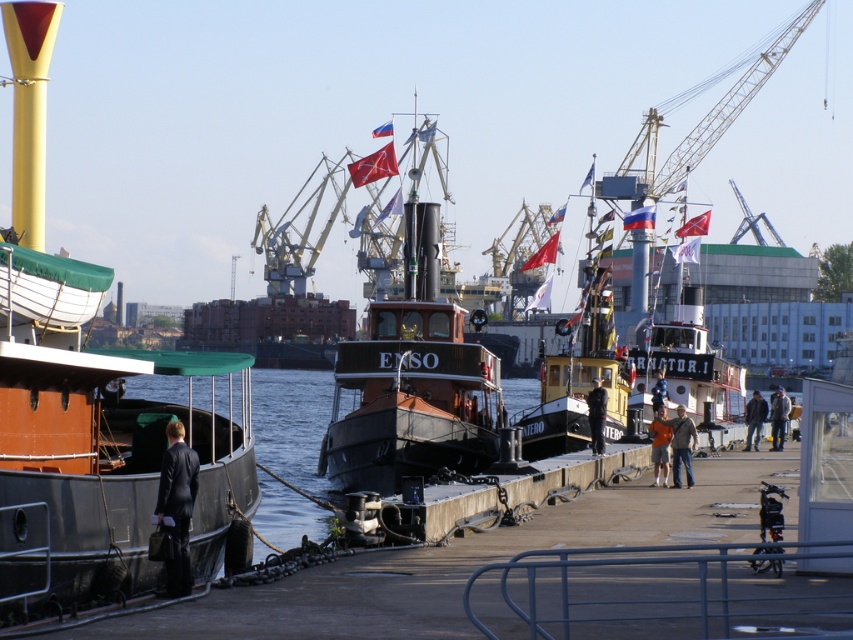
You are standing at the dock and want to reach the tugboat ENSO. There are two points marked on the dock, point (786, 397) and point (744, 417). Which point should you walk towards to get closer to the tugboat?

You should walk towards point (744, 417) because it is behind point (786, 397), and thus closer to the tugboat ENSO.

You are a photographer planning to capture a closeup shot of the metallic red boat at center and the brown leather jacket at lower right. Since you want both subjects to appear the same size in the photo, which subject should you move closer to the camera?

The metallic red boat at center is larger in size than the brown leather jacket at lower right. To make both subjects appear the same size in the photo, you should move the metallic red boat at center farther away from the camera and bring the brown leather jacket at lower right closer to the camera.

You are a security guard at the harbor and need to identify the clothing items of the person in the center. Are the dark blue uniform at center and dark blue jeans at center positioned in a way that the uniform is covering part of the jeans?

The dark blue uniform at center is above dark blue jeans at center, so yes, the uniform is covering part of the jeans.